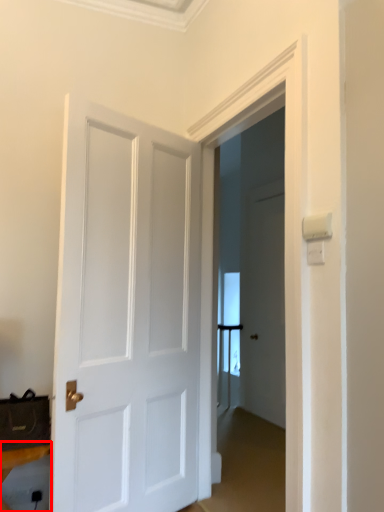
Question: Where is furniture (annotated by the red box) located in relation to door in the image?

Choices:
 (A) left
 (B) right

Answer: (A)